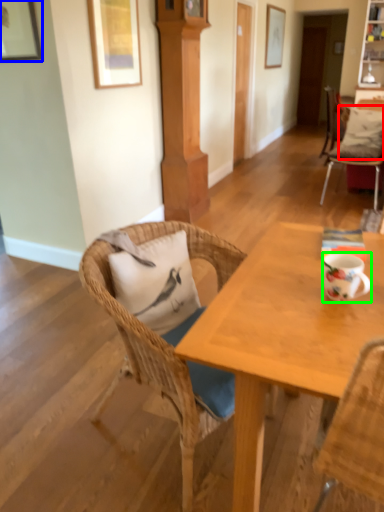
Question: Which object is the farthest from pillow (highlighted by a red box)? Choose among these: picture frame (highlighted by a blue box) or coffee cup (highlighted by a green box).

Choices:
 (A) picture frame
 (B) coffee cup

Answer: (B)